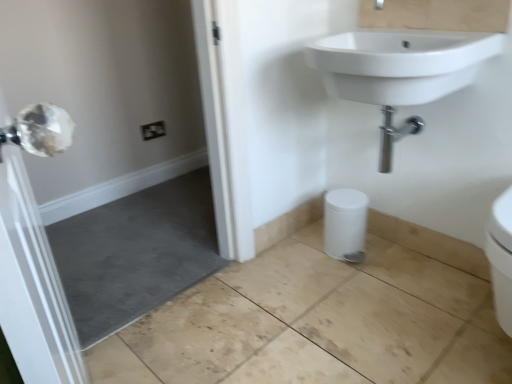
The height and width of the screenshot is (384, 512). I want to click on clear glass door at left, so click(x=116, y=151).

What is the approximate height of white ceramic sink at upper right?

white ceramic sink at upper right is 37.15 centimeters tall.

Find the location of a particular element. white matte bidet at lower center is located at coordinates (345, 224).

In order to click on clear glass door at left in this screenshot , I will do `click(116, 151)`.

In the scene shown: Considering the relative positions of white matte bidet at lower center and clear glass door at left in the image provided, is white matte bidet at lower center to the right of clear glass door at left from the viewer's perspective?

Yes.

Which is in front, white matte bidet at lower center or clear glass door at left?

clear glass door at left is in front.

Between point (348, 193) and point (177, 264), which one is positioned in front?

The point (348, 193) is closer to the camera.

Looking at this image, from the image's perspective, does white matte bidet at lower center appear lower than clear glass door at left?

Yes.

Is white ceramic sink at upper right not within white matte bidet at lower center?

white ceramic sink at upper right lies outside white matte bidet at lower center's area.

Who is bigger, white ceramic sink at upper right or white matte bidet at lower center?

With larger size is white ceramic sink at upper right.

You are a GUI agent. You are given a task and a screenshot of the screen. Output one action in this format:
    pyautogui.click(x=<x>, y=<y>)
    Task: Click on the sink that is above the white matte bidet at lower center (from a real-world perspective)
    This screenshot has width=512, height=384.
    Given the screenshot: What is the action you would take?
    pyautogui.click(x=409, y=57)

Can you tell me how much white ceramic sink at upper right and white matte bidet at lower center differ in facing direction?

The angular difference between white ceramic sink at upper right and white matte bidet at lower center is 1.48 degrees.

Considering the positions of objects clear glass door at left and white matte bidet at lower center in the image provided, who is behind, clear glass door at left or white matte bidet at lower center?

white matte bidet at lower center is behind.

Is white matte bidet at lower center at the back of clear glass door at left?

No.

Is clear glass door at left bigger than white matte bidet at lower center?

Yes.

How different are the orientations of clear glass door at left and white matte bidet at lower center in degrees?

89.4 degrees separate the facing orientations of clear glass door at left and white matte bidet at lower center.

Does point (469, 3) come behind point (85, 8)?

No, it is not.

Is white ceramic sink at upper right in front of or behind clear glass door at left in the image?

In the image, white ceramic sink at upper right appears behind clear glass door at left.

Is white ceramic sink at upper right far from clear glass door at left?

white ceramic sink at upper right is positioned a significant distance from clear glass door at left.

Which is in front, point (78, 86) or point (457, 46)?

The point (457, 46) is closer to the camera.

You are a GUI agent. You are given a task and a screenshot of the screen. Output one action in this format:
    pyautogui.click(x=<x>, y=<y>)
    Task: Click on the sink above the clear glass door at left (from the image's perspective)
    
    Given the screenshot: What is the action you would take?
    tap(409, 57)

From a real-world perspective, who is located lower, clear glass door at left or white ceramic sink at upper right?

clear glass door at left.

Is white matte bidet at lower center positioned far away from white ceramic sink at upper right?

No, white matte bidet at lower center is in close proximity to white ceramic sink at upper right.

Which is more to the left, white matte bidet at lower center or white ceramic sink at upper right?

white matte bidet at lower center is more to the left.

Locate an element on the screen. Image resolution: width=512 pixels, height=384 pixels. bidet behind the clear glass door at left is located at coordinates [345, 224].

The width and height of the screenshot is (512, 384). I want to click on sink in front of the white matte bidet at lower center, so click(x=409, y=57).

Which object lies further to the anchor point clear glass door at left, white ceramic sink at upper right or white matte bidet at lower center?

Among the two, white ceramic sink at upper right is located further to clear glass door at left.

Looking at the image, which one is located further to white matte bidet at lower center, clear glass door at left or white ceramic sink at upper right?

clear glass door at left.

From the image, which object appears to be nearer to clear glass door at left, white matte bidet at lower center or white ceramic sink at upper right?

white matte bidet at lower center lies closer to clear glass door at left than the other object.

Based on their spatial positions, is white ceramic sink at upper right or clear glass door at left closer to white matte bidet at lower center?

white ceramic sink at upper right lies closer to white matte bidet at lower center than the other object.

When comparing their distances from white ceramic sink at upper right, does clear glass door at left or white matte bidet at lower center seem closer?

white matte bidet at lower center is positioned closer to the anchor white ceramic sink at upper right.

In the scene shown: Estimate the real-world distances between objects in this image. Which object is closer to white ceramic sink at upper right, white matte bidet at lower center or clear glass door at left?

Based on the image, white matte bidet at lower center appears to be nearer to white ceramic sink at upper right.

Identify the location of bidet situated between clear glass door at left and white ceramic sink at upper right from left to right. (345, 224).